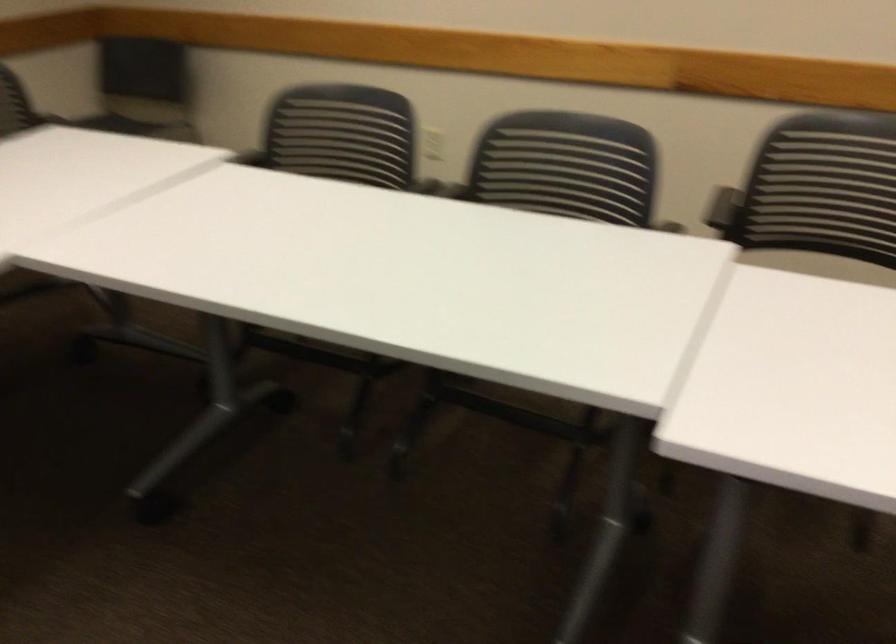
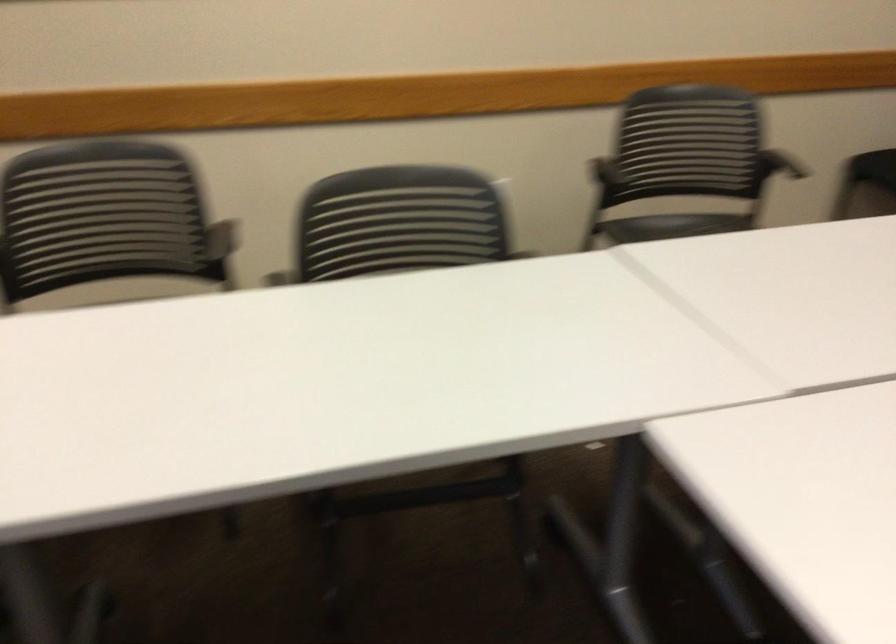
Question: Based on the continuous images, in which direction is the camera rotating? Reply with the corresponding letter.

Choices:
 (A) Left
 (B) Right
 (C) Up
 (D) Down

Answer: (B)